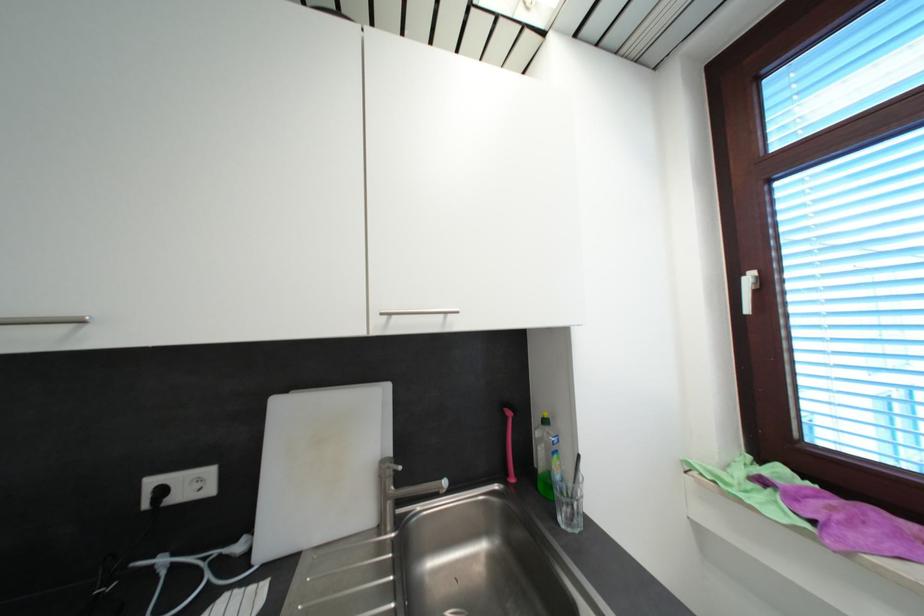
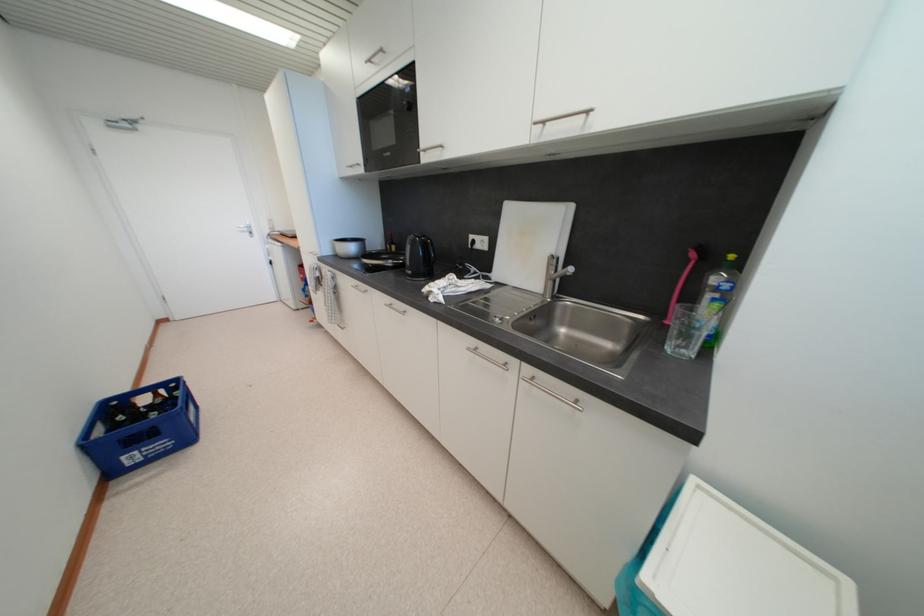
The point at (561, 459) is marked in the first image. Where is the corresponding point in the second image?

(723, 307)